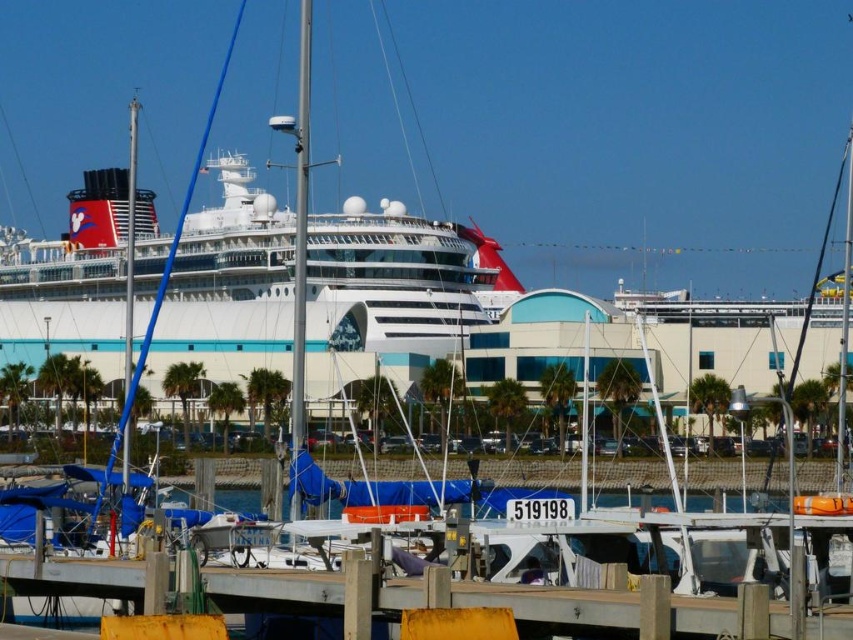
You are standing at the point marked as point (x=90, y=326) in the marina scene. You want to take a photo of the cruise ship with the red funnel and Mickey Mouse logo. If your camera has a maximum zoom range of 100 meters, will you be able to capture the cruise ship clearly?

The distance between point (x=90, y=326) and the camera is 144.74 meters. Since the camera can only zoom up to 100 meters, you will not be able to capture the cruise ship clearly from that point.

You are standing on the dock and notice the white glossy cruise ship at center and the yellow painted wood at lower center. Which object is positioned to the left when viewed from your perspective?

The white glossy cruise ship at center is to the left of the yellow painted wood at lower center from your perspective.

You are a photographer planning to capture the white glossy cruise ship at center and the yellow painted wood at lower center in one frame. Given that your camera has a fixed field of view, can you fit both objects in the shot without moving the camera?

The white glossy cruise ship at center is wider than the yellow painted wood at lower center, but since both are within the same general area of the scene, it should be possible to frame the shot to include both objects without moving the camera.